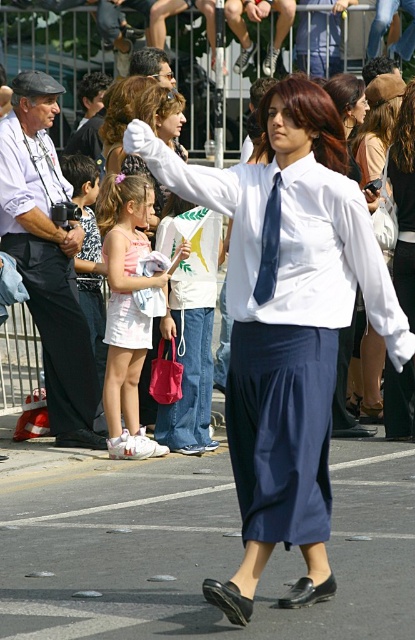
You are a photographer at the event and need to position yourself to capture both the white smooth dress shirt at center and the white cotton dress at center in the same frame. Based on their positions, which one should you focus on first to ensure both are in the shot?

The white smooth dress shirt at center is to the right of the white cotton dress at center, so you should focus on the white cotton dress at center first to ensure both are in the shot.

What object is located at the coordinates point (287, 326) in the image?

The point (287, 326) corresponds to the white smooth dress shirt at center.

You are a photographer at the event and want to capture both the white smooth dress shirt at center and the white satin dress at center in a single frame. Which object should you position on the left side of the frame to ensure both are visible?

You should position the white satin dress at center on the left side of the frame because the white smooth dress shirt at center is to the right of it, ensuring both are included in the photo.